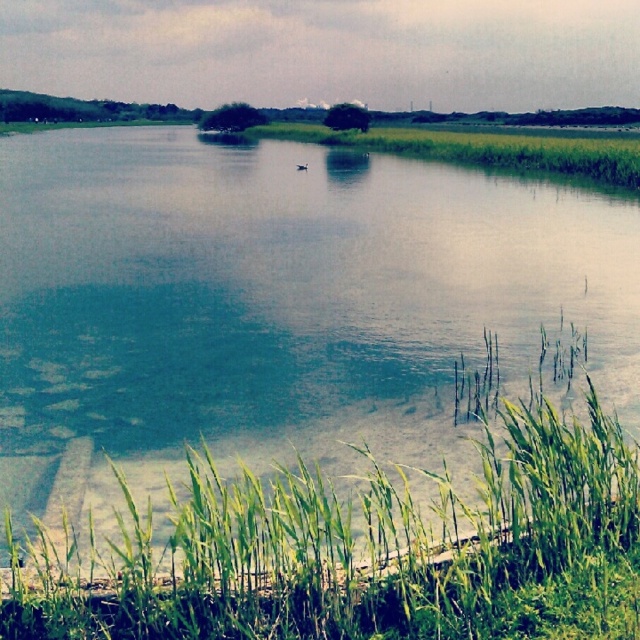
Does point (269, 364) come in front of point (401, 140)?

Yes, it is in front of point (401, 140).

Is point (433, 419) more distant than point (451, 145)?

No, (433, 419) is in front of (451, 145).

Locate an element on the screen. This screenshot has height=640, width=640. clear water at center is located at coordinates (275, 305).

What do you see at coordinates (275, 305) in the screenshot?
I see `clear water at center` at bounding box center [275, 305].

Does clear water at center have a lesser width compared to green grass at lower right?

In fact, clear water at center might be wider than green grass at lower right.

Is point (163, 497) more distant than point (406, 493)?

That is True.

The width and height of the screenshot is (640, 640). What are the coordinates of `clear water at center` in the screenshot? It's located at (275, 305).

Is green grass at lower right bigger than green grass at center?

No, green grass at lower right is not bigger than green grass at center.

Who is more forward, [573,602] or [401,134]?

Point [573,602]

The image size is (640, 640). In order to click on green grass at lower right in this screenshot , I will do `click(365, 550)`.